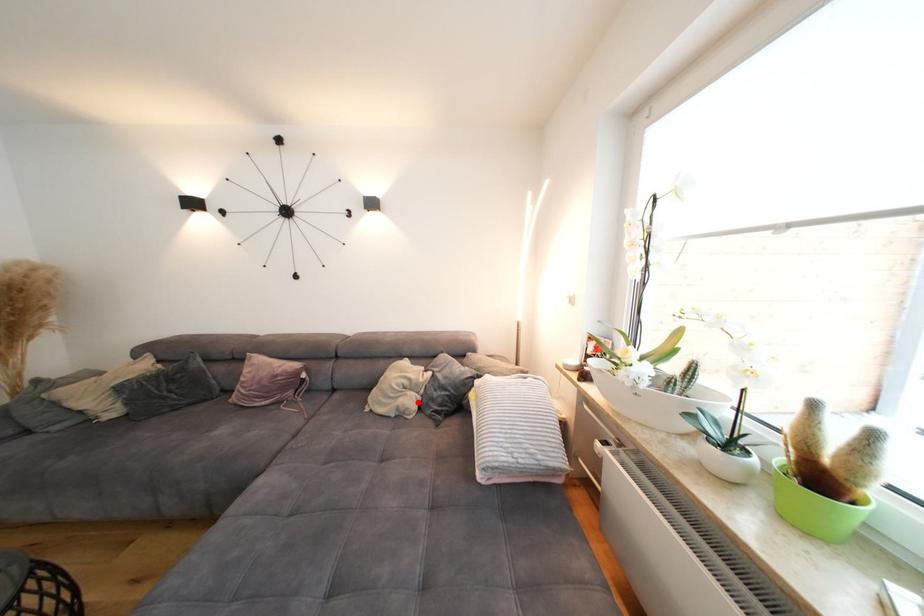
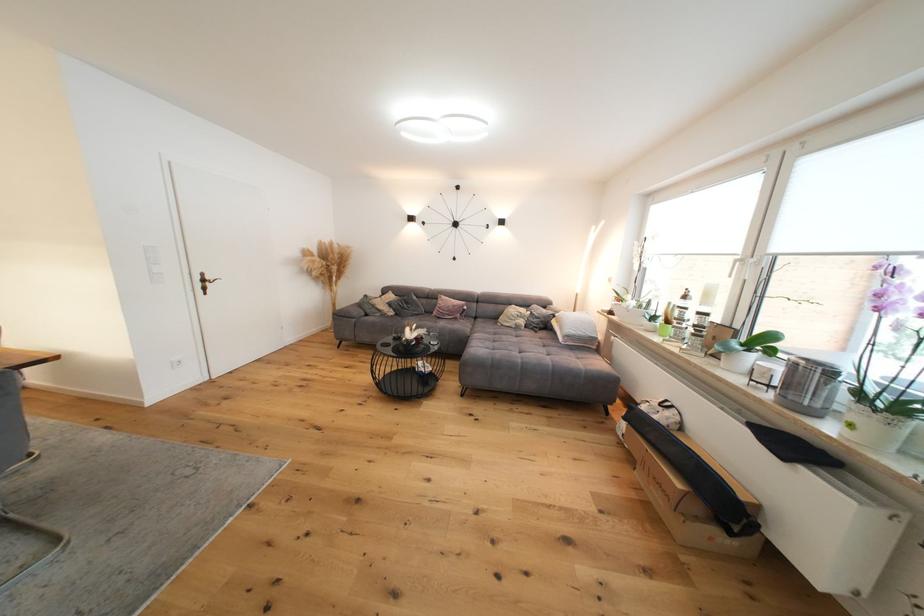
The point at the highlighted location is marked in the first image. Where is the corresponding point in the second image?

(529, 323)